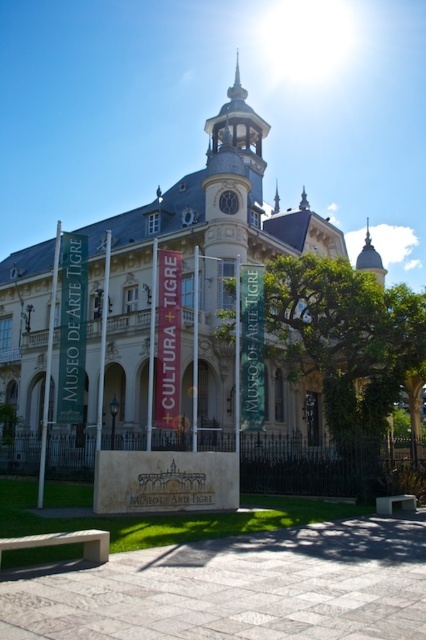
You are a visitor standing in front of the Museo de Arte Tigre. You see the light gray stone clock tower at upper center and the wooden park bench at lower right. Which object is larger in size?

The light gray stone clock tower at upper center is bigger than the wooden park bench at lower right.

You are sitting on the wooden park bench at lower right and want to move to the smooth concrete bench at lower left. Which direction should you move to reach it?

Answer: The smooth concrete bench at lower left is located above the wooden park bench at lower right, so you should move upward to reach it.

Consider the image. You are standing in front of the Museo de Arte Tigre and want to take a photo that includes both the flagpole at point (x=259, y=189) and the clock tower at point (x=411, y=493). Based on their positions, which flagpole should you position closer to the camera to ensure both are in focus?

Point (x=259, y=189) is further to the camera than point (x=411, y=493). To ensure both are in focus, you should position the flagpole at point (x=259, y=189) closer to the camera so that the distance between them is minimized.